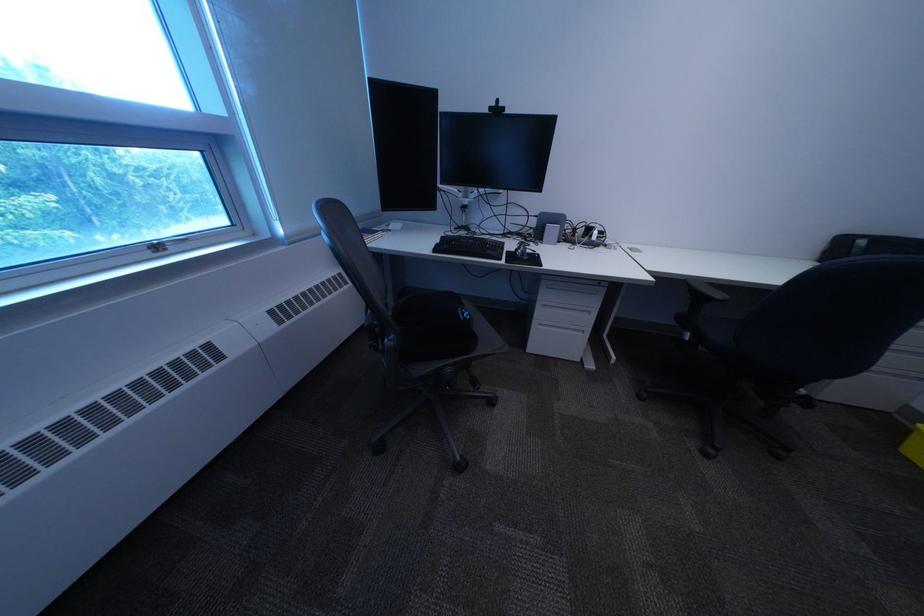
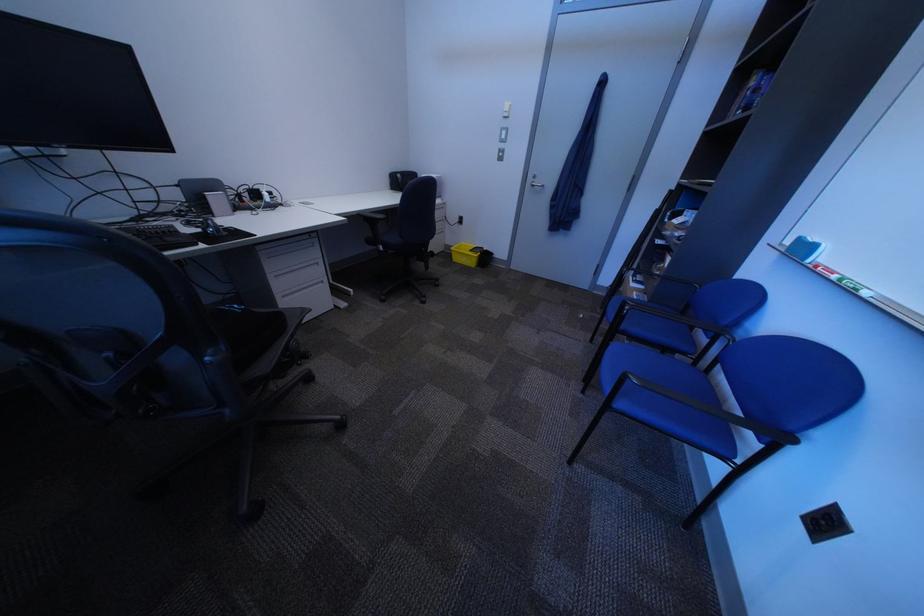
Find the pixel in the second image that matches the point at 483,318 in the first image.

(259, 309)